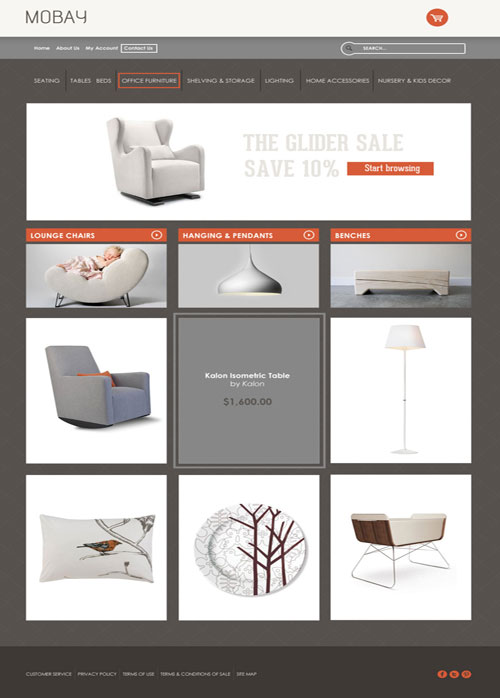
Identify the location of oddly shaped chair for sale. 419,530.